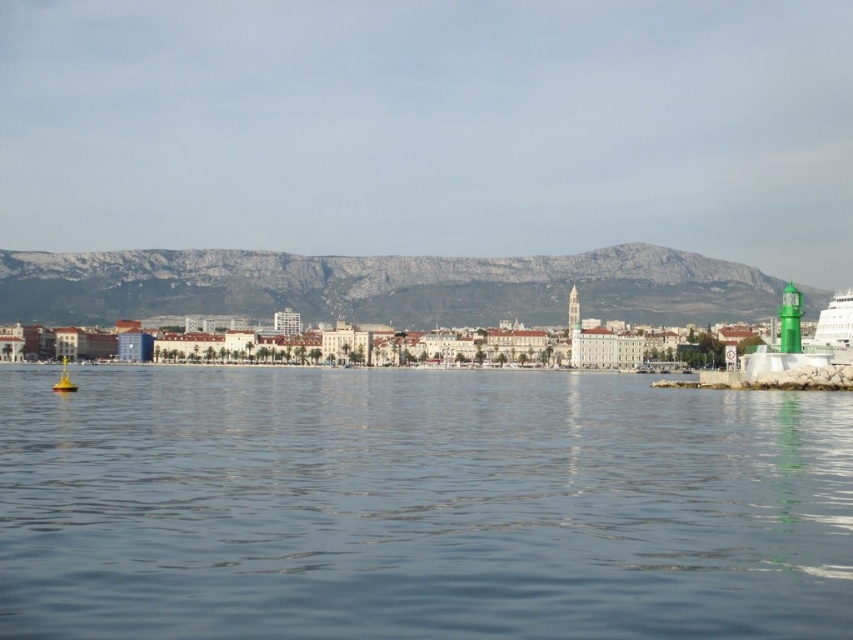
You are a photographer planning to capture a wide shot of the coastal cityscape. You need to ensure that both the blue water at center and the gray rocky mountain at upper center are fully visible in your frame. Given their widths, which object will require you to adjust your camera angle more to include it in the shot?

Result: The gray rocky mountain at upper center has a greater width than the blue water at center, so it will require adjusting the camera angle more to ensure it fits entirely within the frame.

You are a sailor trying to navigate a boat through the coastal area shown. You see the gray rocky mountain at upper center and the yellow matte buoy at lower left. Which object is higher in elevation?

The gray rocky mountain at upper center is taller than the yellow matte buoy at lower left, so the gray rocky mountain at upper center has a higher elevation.